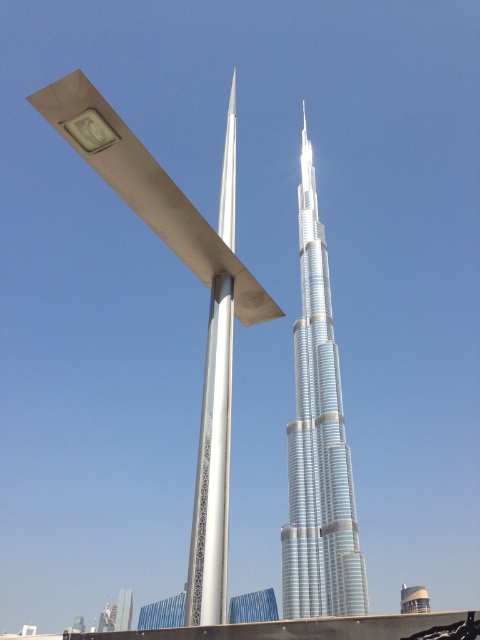
From the picture: You are a drone operator planning to fly a drone between the silver metallic burj khalifa at center and the silver metallic pole at center. Given that the drone has a maximum flight height of 800 meters, can it safely pass between them without hitting either structure?

The silver metallic burj khalifa at center is taller than the silver metallic pole at center. The Burj Khalifa is the tallest building globally, standing at 828 meters. Since the drone can only fly up to 800 meters, it cannot reach the height of the Burj Khalifa. Therefore, the drone would hit the Burj Khalifa at center if attempting to fly between them.

You are standing at the base of the Burj Khalifa and want to take a photo of the modern angular structure on the left. However, there are two points in your viewfinder at coordinates point (314, 221) and point (206, 444). Which point is closer to you, the photographer?

Point (206, 444) is closer to you because the description states that point (314, 221) is behind point (206, 444).